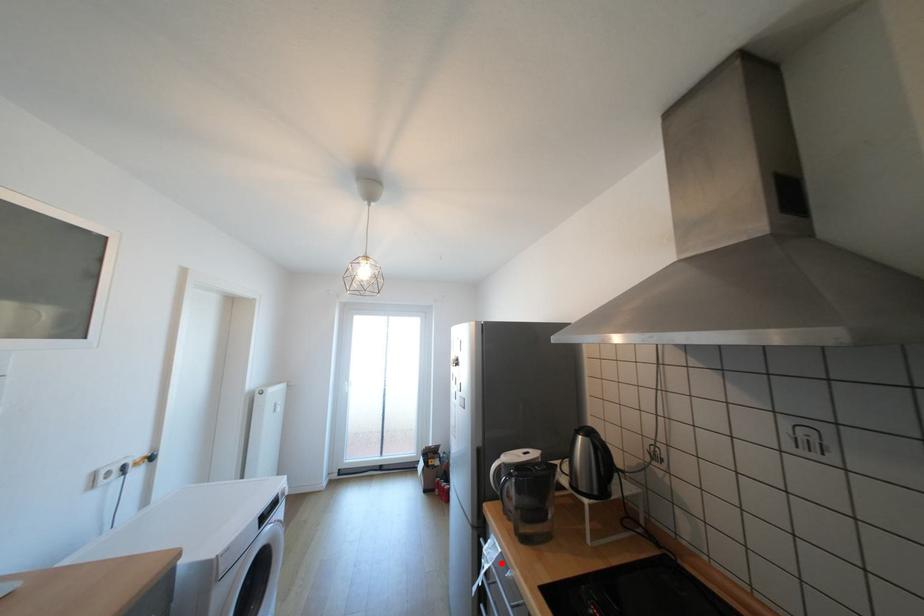
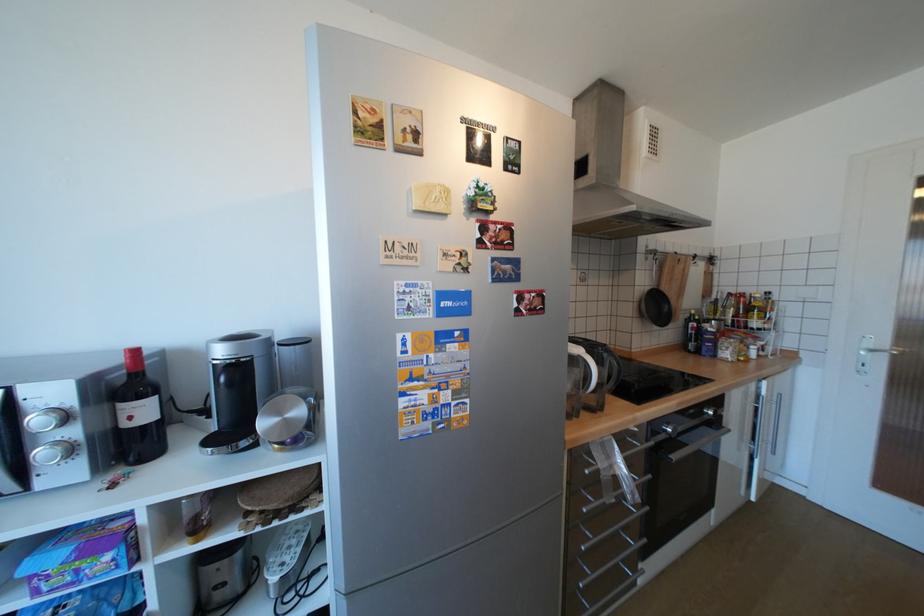
In the second image, find the point that corresponds to the highlighted location in the first image.

(630, 452)